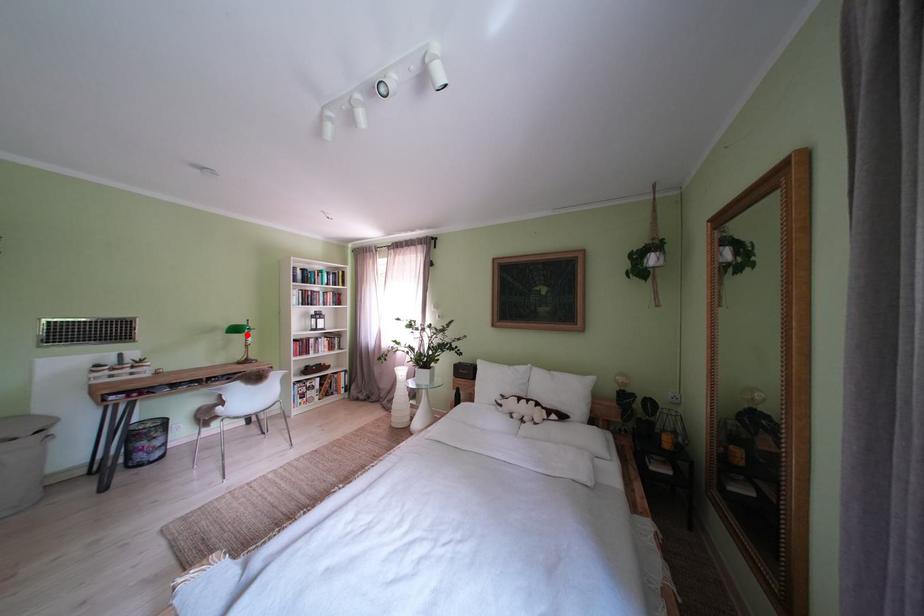
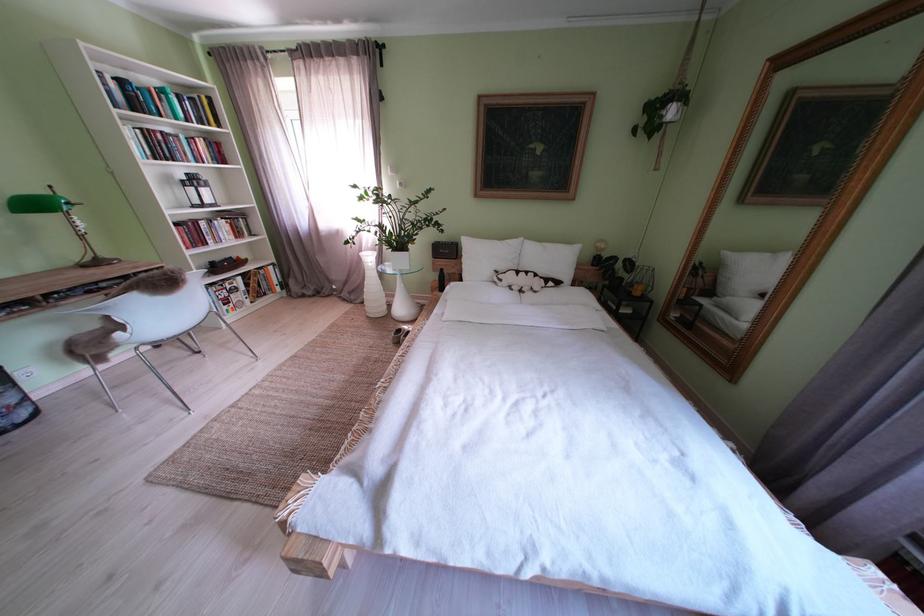
The point at the highlighted location is marked in the first image. Where is the corresponding point in the second image?

(46, 209)